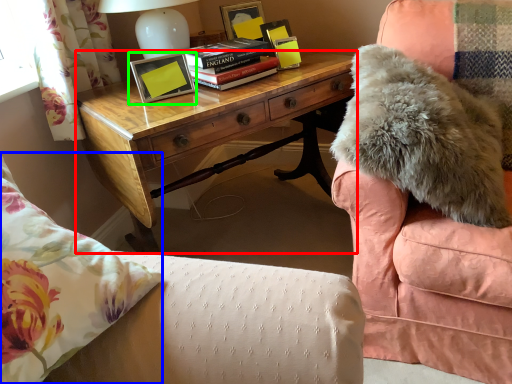
Question: Estimate the real-world distances between objects in this image. Which object is farther from desk (highlighted by a red box), throw pillow (highlighted by a blue box) or picture frame (highlighted by a green box)?

Choices:
 (A) throw pillow
 (B) picture frame

Answer: (A)